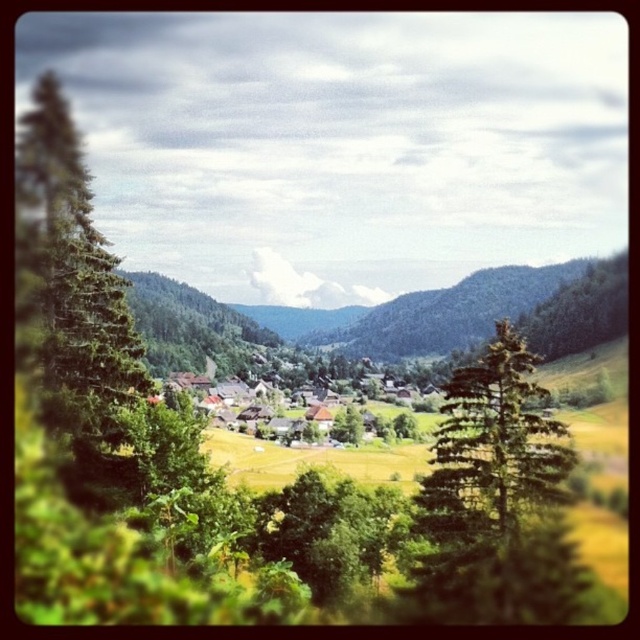
Question: Is wooden houses at center above green leafy tree at center?

Choices:
 (A) yes
 (B) no

Answer: (A)

Question: Which object is positioned closest to the green textured tree at center?

Choices:
 (A) green leafy tree at center
 (B) wooden houses at center

Answer: (B)

Question: Is wooden houses at center wider than green leafy tree at center?

Choices:
 (A) yes
 (B) no

Answer: (A)

Question: Does green textured tree at center have a smaller size compared to green leafy tree at center?

Choices:
 (A) yes
 (B) no

Answer: (B)

Question: Which object is farther from the camera taking this photo?

Choices:
 (A) green textured tree at center
 (B) wooden houses at center
 (C) green leafy tree at center

Answer: (B)

Question: Which object is positioned closest to the green textured tree at center?

Choices:
 (A) wooden houses at center
 (B) green leafy tree at center

Answer: (A)